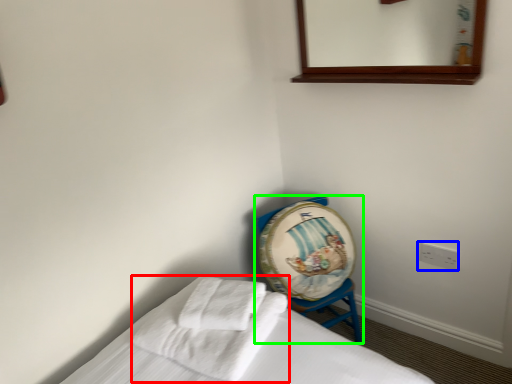
Question: Which object is the farthest from bath towel (highlighted by a red box)? Choose among these: electric outlet (highlighted by a blue box) or furniture (highlighted by a green box).

Choices:
 (A) electric outlet
 (B) furniture

Answer: (A)